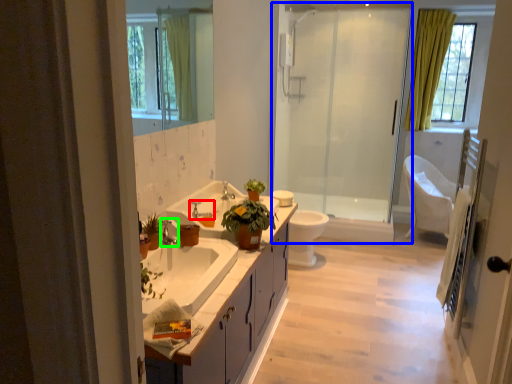
Question: Which object is the closest to the tap (highlighted by a red box)? Choose among these: shower door (highlighted by a blue box) or faucet (highlighted by a green box).

Choices:
 (A) shower door
 (B) faucet

Answer: (B)